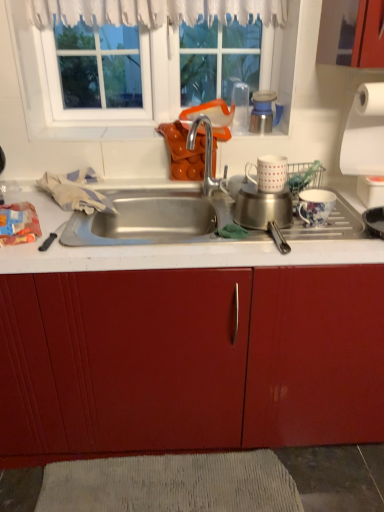
Question: From a real-world perspective, is brushed metal cup at upper center physically located above or below white textured mat at lower center?

Choices:
 (A) below
 (B) above

Answer: (B)

Question: In terms of size, does brushed metal cup at upper center appear bigger or smaller than white textured mat at lower center?

Choices:
 (A) small
 (B) big

Answer: (A)

Question: Estimate the real-world distances between objects in this image. Which object is closer to the silver metallic faucet at center?

Choices:
 (A) white textured mat at lower center
 (B) white matte coffee cup at upper center, the 1th coffee cup viewed from the left
 (C) brushed metal cup at upper center
 (D) white glass window at upper center
 (E) white paper at right

Answer: (C)

Question: Considering the real-world distances, which object is closest to the white textured mat at lower center?

Choices:
 (A) white matte coffee cup at upper center, marked as the second coffee cup in a right-to-left arrangement
 (B) floral porcelain mug at right, the 1th coffee cup in the right-to-left sequence
 (C) silver metallic faucet at center
 (D) white paper at right
 (E) brushed metal cup at upper center

Answer: (B)